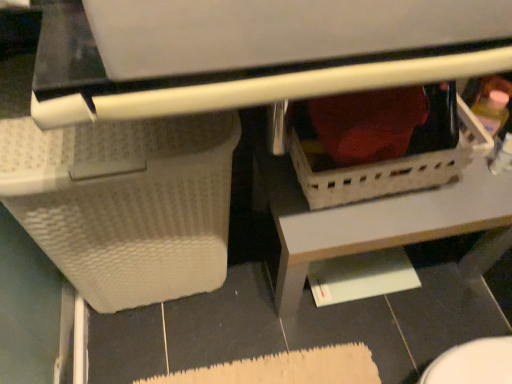
At what (x,y) coordinates should I click in order to perform the action: click on free point above white textured basket at lower left, marked as the first basket in a left-to-right arrangement (from a real-world perspective). Please return your answer as a coordinate pair (x, y). The width and height of the screenshot is (512, 384). Looking at the image, I should click on (79, 130).